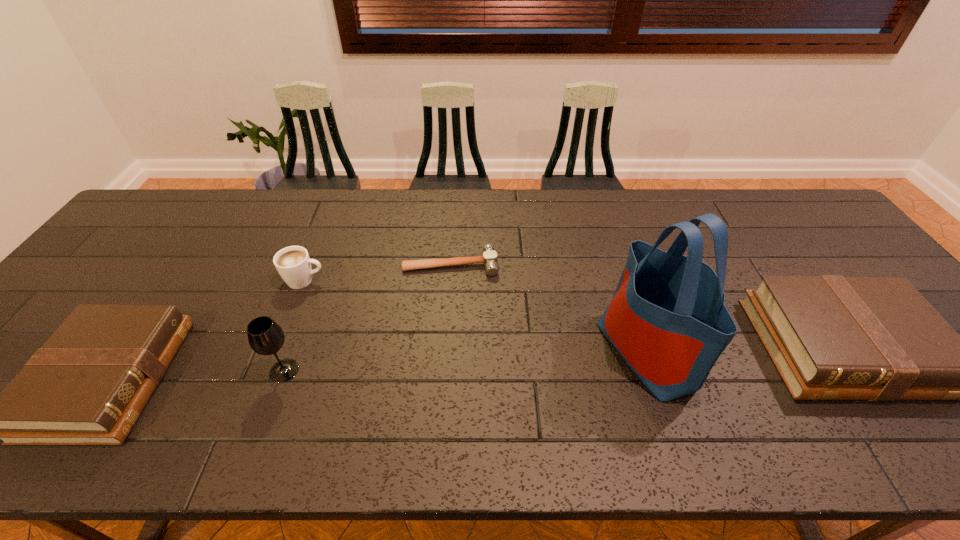
Locate an element on the screen. The image size is (960, 540). vacant space at the left edge of the desktop is located at coordinates (156, 254).

This screenshot has height=540, width=960. In order to click on empty space that is in between the hammer and the fifth shortest object in this screenshot , I will do `click(368, 317)`.

The height and width of the screenshot is (540, 960). I want to click on free space between the fifth object from left to right and the shorter Bible, so click(x=378, y=365).

Identify the location of unoccupied position between the left Bible and the handbag. This screenshot has height=540, width=960. coord(378,365).

This screenshot has height=540, width=960. I want to click on blank region between the cappuccino and the leftmost object, so click(x=207, y=329).

At what (x,y) coordinates should I click in order to perform the action: click on free spot between the cappuccino and the left Bible. Please return your answer as a coordinate pair (x, y). The height and width of the screenshot is (540, 960). Looking at the image, I should click on (207, 329).

Locate an element on the screen. vacant area that lies between the hammer and the cappuccino is located at coordinates (377, 272).

You are a GUI agent. You are given a task and a screenshot of the screen. Output one action in this format:
    pyautogui.click(x=<x>, y=<y>)
    Task: Click on the unoccupied area between the second tallest object and the tallest object
    
    Given the screenshot: What is the action you would take?
    pyautogui.click(x=466, y=361)

This screenshot has height=540, width=960. I want to click on vacant space in between the tallest object and the fifth shortest object, so click(x=466, y=361).

Identify the location of vacant space that is in between the shorter Bible and the tallest object. (378, 365).